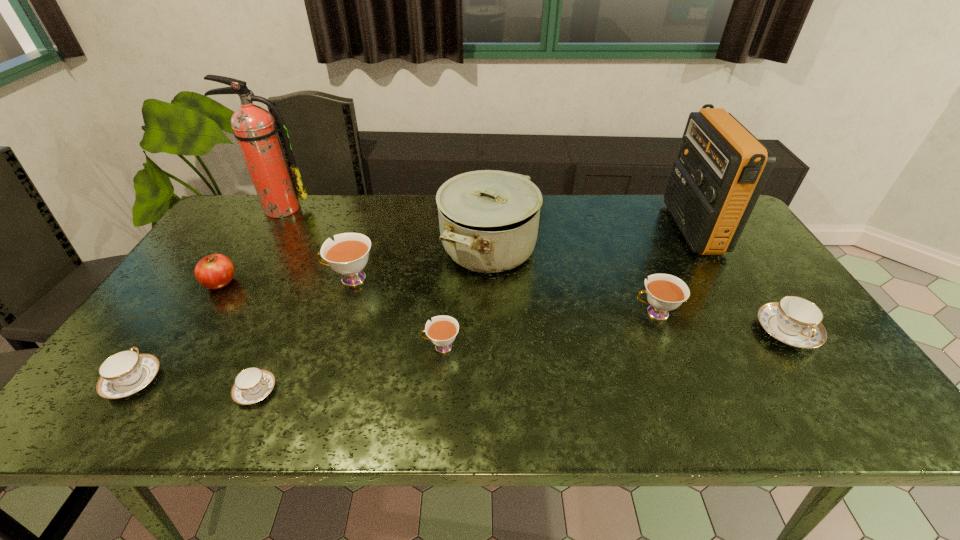
Find the location of a particular element. apple at the left edge is located at coordinates (215, 271).

Locate an element on the screen. The width and height of the screenshot is (960, 540). teacup at the left edge is located at coordinates (127, 372).

This screenshot has width=960, height=540. Identify the location of radio receiver at the right edge. (721, 170).

The image size is (960, 540). What are the coordinates of `teacup that is at the right edge` in the screenshot? It's located at (795, 321).

Locate an element on the screen. object that is at the far left corner is located at coordinates (254, 128).

Where is `object positioned at the near left corner`? object positioned at the near left corner is located at coordinates (127, 372).

Where is `object at the far right corner`? This screenshot has width=960, height=540. object at the far right corner is located at coordinates (721, 170).

In the image, there is a desktop. Find the location of `vacant space at the far edge`. vacant space at the far edge is located at coordinates (284, 218).

In the image, there is a desktop. Where is `free space at the near edge`? free space at the near edge is located at coordinates (612, 397).

Identify the location of vacant space at the right edge of the desktop. This screenshot has height=540, width=960. (772, 291).